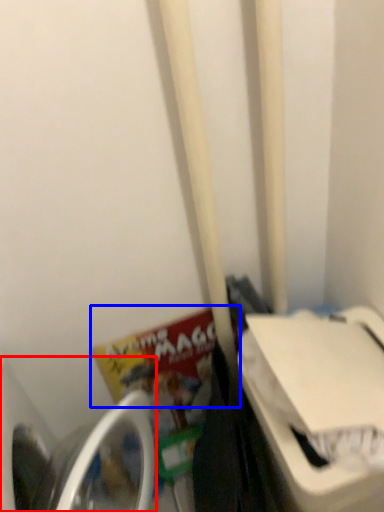
Question: Which object appears closest to the camera in this image, washing machine (highlighted by a red box) or book (highlighted by a blue box)?

Choices:
 (A) washing machine
 (B) book

Answer: (A)